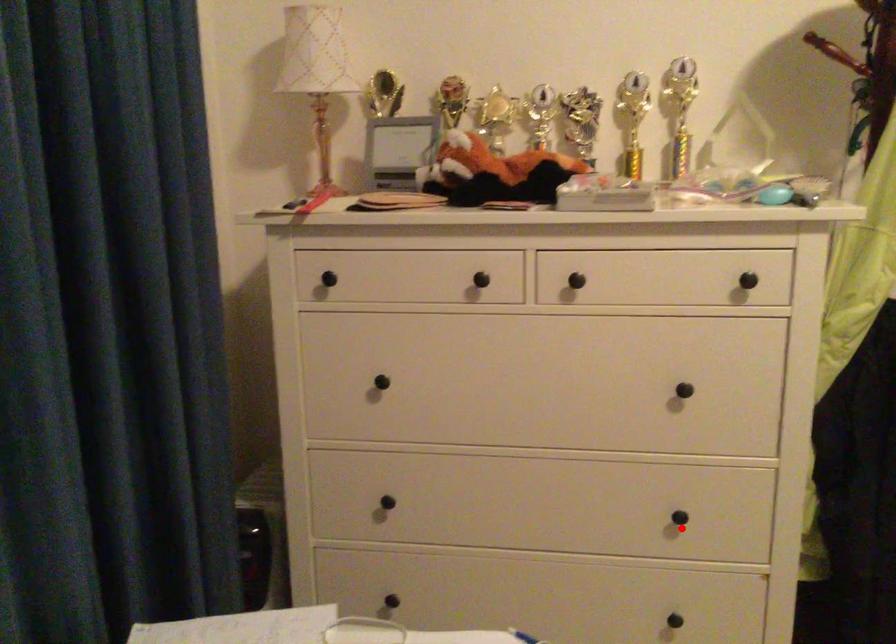
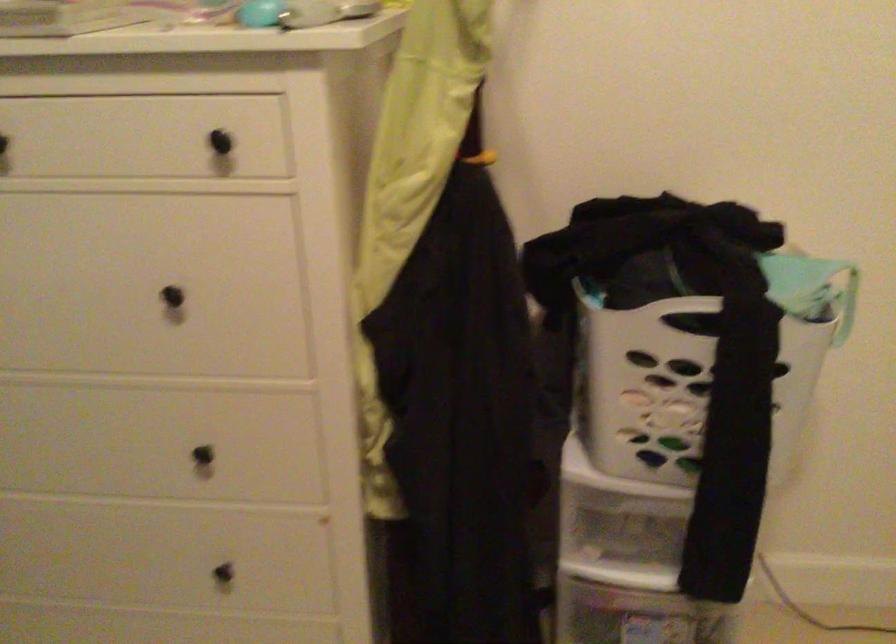
Question: I am providing you with two images of the same scene from different viewpoints. Image1 has a red point marked. In image2, the corresponding 3D location appears at what relative position? Reply with the corresponding letter.

Choices:
 (A) Closer
 (B) Farther

Answer: (A)